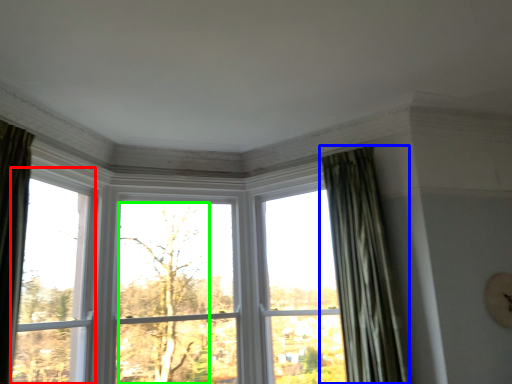
Question: Based on their relative distances, which object is nearer to window (highlighted by a red box)? Choose from curtain (highlighted by a blue box) and tree (highlighted by a green box).

Choices:
 (A) curtain
 (B) tree

Answer: (B)